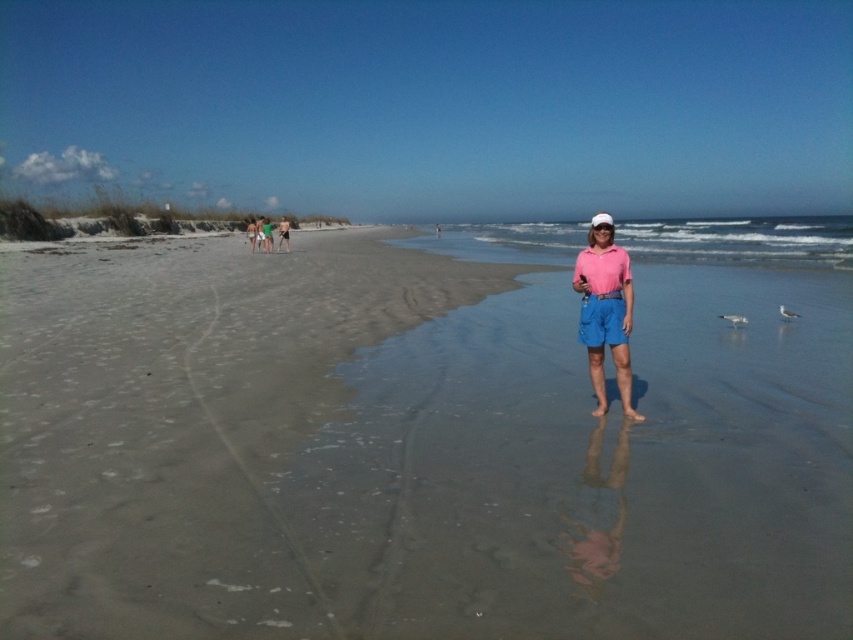
Which is more to the left, blue water at center or pink cotton shorts at center?

Positioned to the left is pink cotton shorts at center.

Where is `blue water at center`? The image size is (853, 640). blue water at center is located at coordinates (741, 240).

At what (x,y) coordinates should I click in order to perform the action: click on blue water at center. Please return your answer as a coordinate pair (x, y). Looking at the image, I should click on (741, 240).

Measure the distance between blue water at center and green fabric shorts at center.

blue water at center and green fabric shorts at center are 143.69 feet apart from each other.

Is point (706, 253) less distant than point (277, 230)?

Yes.

The width and height of the screenshot is (853, 640). What do you see at coordinates (741, 240) in the screenshot?
I see `blue water at center` at bounding box center [741, 240].

Locate an element on the screen. The height and width of the screenshot is (640, 853). blue water at center is located at coordinates (741, 240).

Based on the photo, is sandy beach at center thinner than pink cotton shorts at center?

In fact, sandy beach at center might be wider than pink cotton shorts at center.

Can you confirm if sandy beach at center is smaller than pink cotton shorts at center?

Actually, sandy beach at center might be larger than pink cotton shorts at center.

Is point (637, 410) positioned before point (596, 264)?

No, it is not.

Find the location of a particular element. Image resolution: width=853 pixels, height=640 pixels. sandy beach at center is located at coordinates (422, 442).